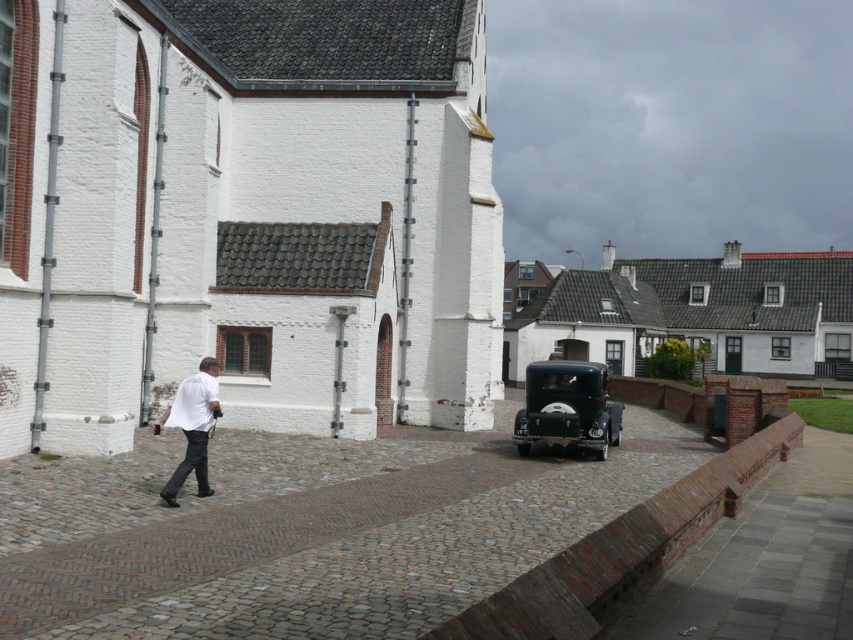
Question: Where is brown cobblestone pavement at center located in relation to shiny black car at center in the image?

Choices:
 (A) below
 (B) above

Answer: (A)

Question: Can you confirm if brown cobblestone pavement at center is positioned to the right of white matte shirt at lower left?

Choices:
 (A) no
 (B) yes

Answer: (B)

Question: Is shiny black car at center wider than white matte shirt at lower left?

Choices:
 (A) no
 (B) yes

Answer: (B)

Question: Considering the real-world distances, which object is farthest from the shiny black car at center?

Choices:
 (A) white matte shirt at lower left
 (B) brown cobblestone pavement at center

Answer: (A)

Question: Which point appears closest to the camera in this image?

Choices:
 (A) (207, 397)
 (B) (595, 400)

Answer: (A)

Question: Which point is closer to the camera taking this photo?

Choices:
 (A) (177, 483)
 (B) (189, 593)

Answer: (B)